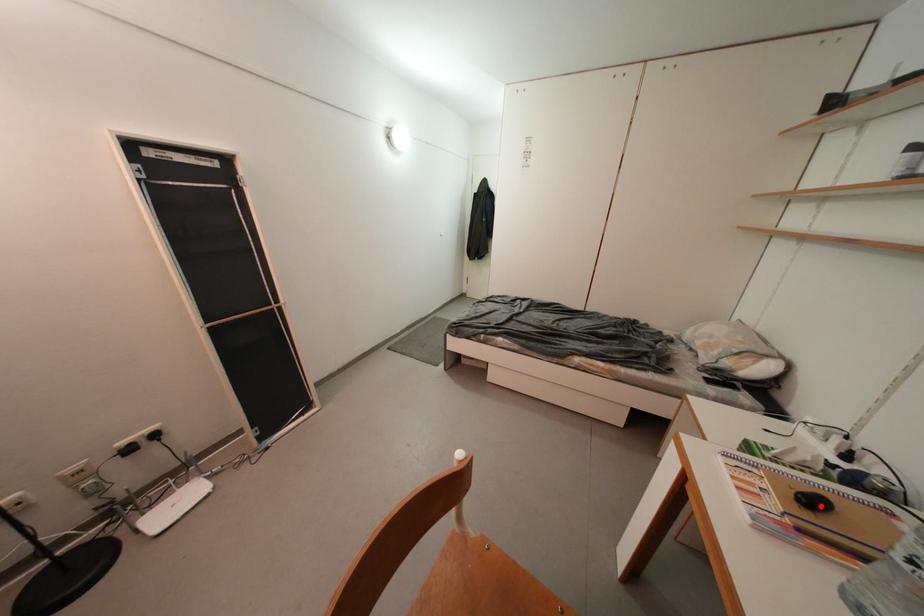
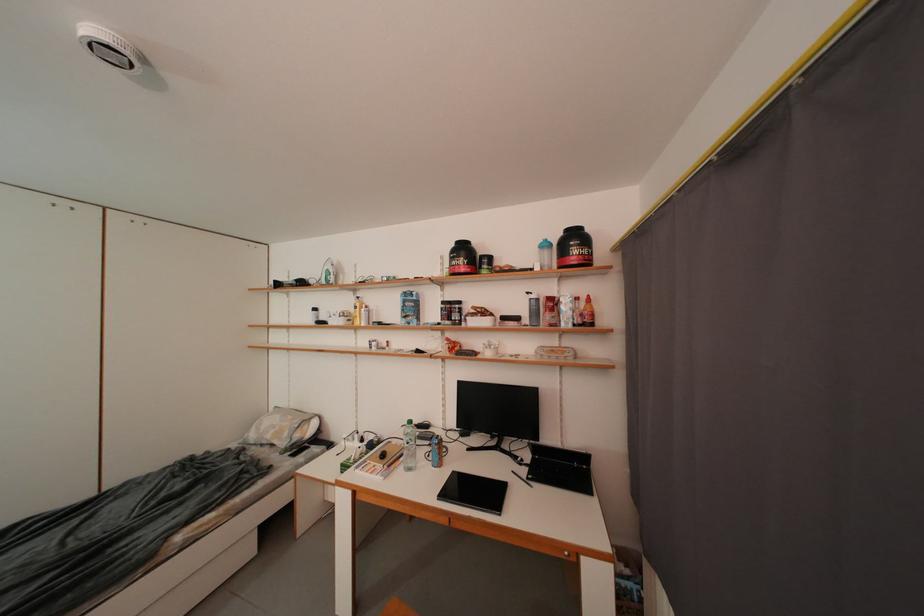
Where in the second image is the point corresponding to the highlighted location from the first image?

(391, 459)